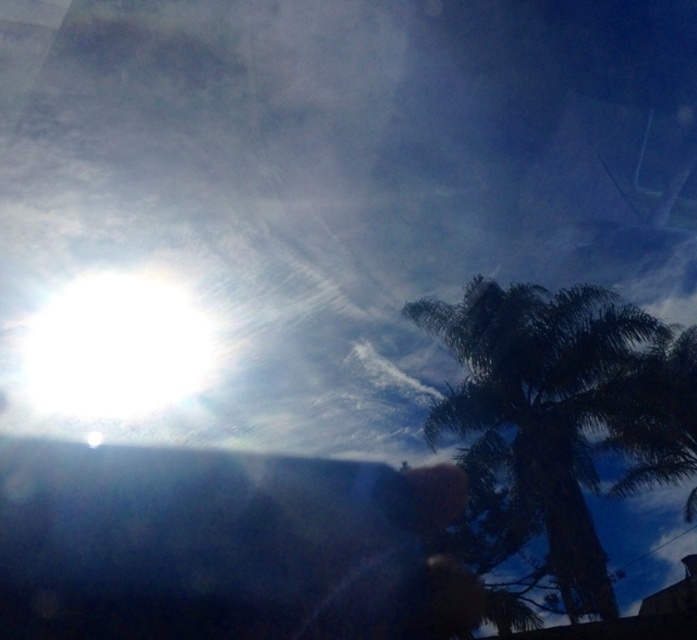
You are an astronomer observing the sky. You notice the green leafy palm tree at upper right and the white glossy sun at upper left. Based on their positions, which object is closer to the horizon?

The green leafy palm tree at upper right is closer to the horizon than the white glossy sun at upper left because it is positioned below it.

You are an astronomer analyzing this image. You need to determine which object occupies more horizontal space in the image between the green leafy palm tree at upper right and the white glossy sun at upper left. Based on the scene, which one is wider?

The green leafy palm tree at upper right is wider than the white glossy sun at upper left according to the description.

You are standing in front of the dramatic sky scene with the bright sun on the left and the palm tree silhouette. There are two points marked in the image. One is at coordinates point (x=505, y=529) and the other at point (x=43, y=324). Which point is closer to your viewpoint?

Point (x=43, y=324) is closer to your viewpoint because it is less further to the camera compared to point (x=505, y=529), which is further away.